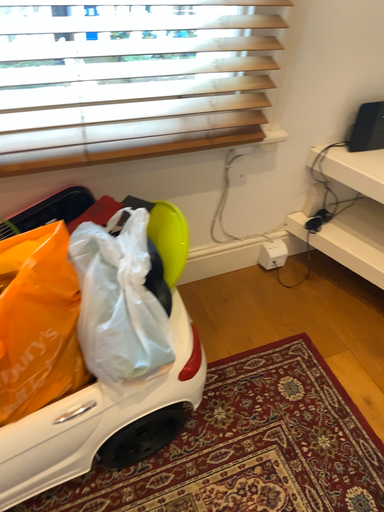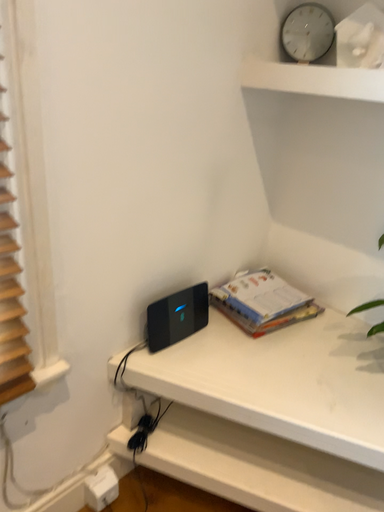
Question: How did the camera likely rotate when shooting the video?

Choices:
 (A) rotated upward
 (B) rotated downward

Answer: (A)